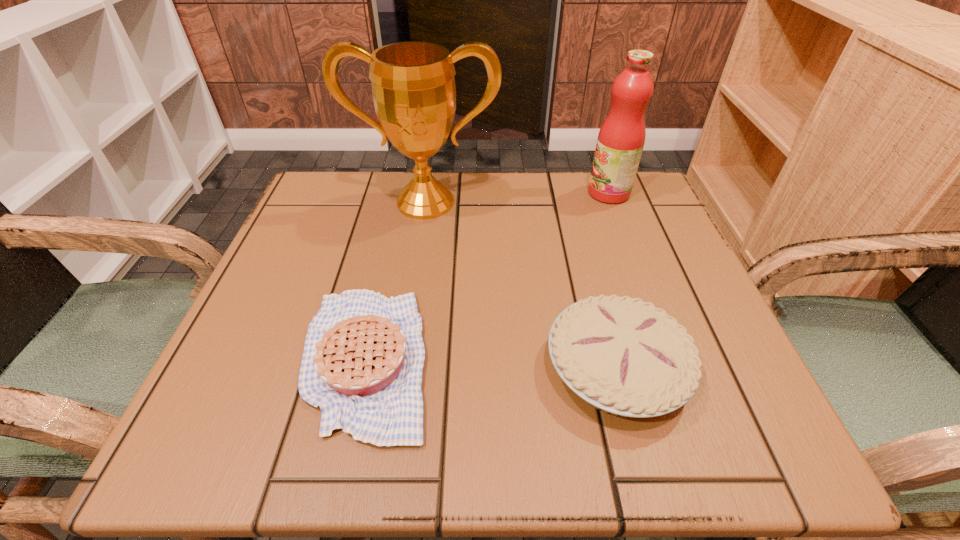
Locate an element on the screen. The image size is (960, 540). award is located at coordinates (413, 86).

Image resolution: width=960 pixels, height=540 pixels. I want to click on fruit juice, so click(620, 142).

You are a GUI agent. You are given a task and a screenshot of the screen. Output one action in this format:
    pyautogui.click(x=<x>, y=<y>)
    Task: Click on the right pie
    Image resolution: width=960 pixels, height=540 pixels.
    Given the screenshot: What is the action you would take?
    pyautogui.click(x=624, y=356)

This screenshot has width=960, height=540. Identify the location of the taller pie. (624, 356).

At what (x,y) coordinates should I click in order to perform the action: click on the shorter pie. Please return your answer as a coordinate pair (x, y). This screenshot has width=960, height=540. Looking at the image, I should click on (362, 363).

Where is `the left pie`? the left pie is located at coordinates (362, 363).

Find the location of a particular element. Image resolution: width=960 pixels, height=540 pixels. free space located 0.050m on the front-facing side of the award is located at coordinates (420, 239).

Where is `vacant position located 0.080m on the front label of the fruit juice`? vacant position located 0.080m on the front label of the fruit juice is located at coordinates pyautogui.click(x=552, y=193).

You are a GUI agent. You are given a task and a screenshot of the screen. Output one action in this format:
    pyautogui.click(x=<x>, y=<y>)
    Task: Click on the vacant region located on the front label of the fruit juice
    
    Given the screenshot: What is the action you would take?
    coord(423,193)

The width and height of the screenshot is (960, 540). I want to click on free space located 0.380m on the front label of the fruit juice, so click(x=419, y=193).